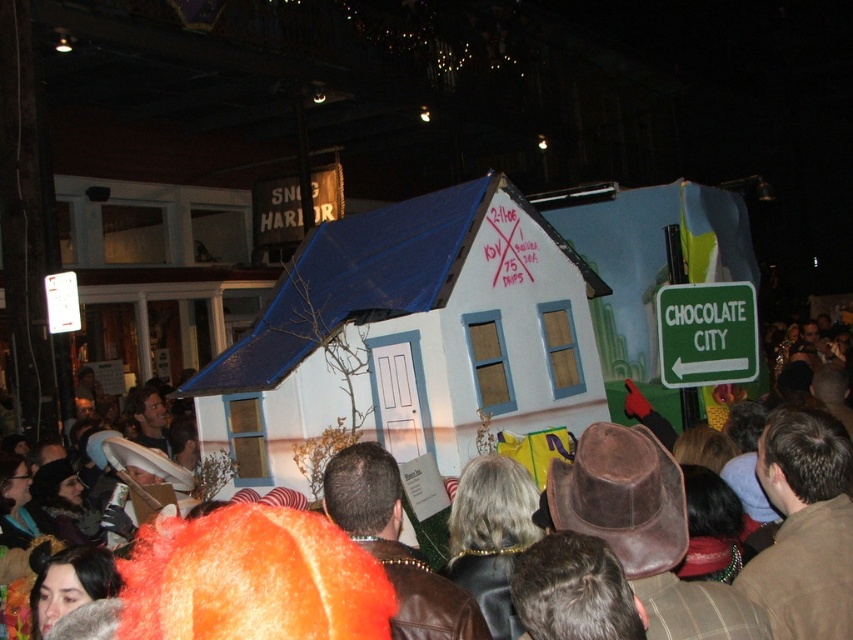
Question: Is brown leather hat at center below green plastic sign at right?

Choices:
 (A) no
 (B) yes

Answer: (B)

Question: Which object appears farthest from the camera in this image?

Choices:
 (A) green plastic sign at right
 (B) brown leather hat at center

Answer: (A)

Question: Does brown leather hat at center have a smaller size compared to green plastic sign at right?

Choices:
 (A) no
 (B) yes

Answer: (A)

Question: From the image, what is the correct spatial relationship of brown leather hat at center in relation to green plastic sign at right?

Choices:
 (A) above
 (B) below

Answer: (B)